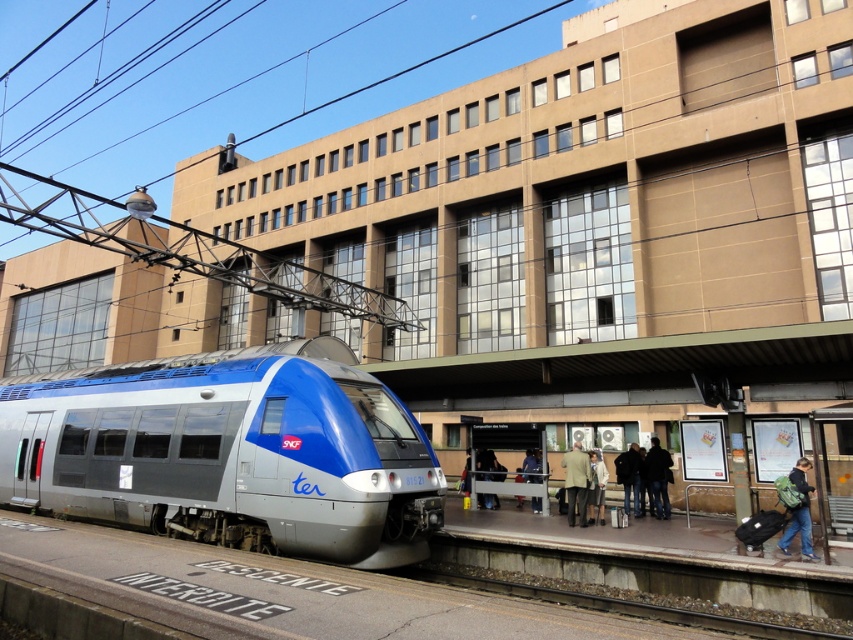
Question: Which object is the farthest from the dark blue jacket at platform right?

Choices:
 (A) metallic silver coach at center
 (B) light beige fabric coat at center
 (C) matte silver bullet train at left

Answer: (C)

Question: Among these objects, which one is farthest from the camera?

Choices:
 (A) metallic silver coach at center
 (B) matte silver bullet train at left
 (C) green backpack at lower right

Answer: (A)

Question: Which object is positioned farthest from the light beige fabric coat at center?

Choices:
 (A) dark blue jacket at platform right
 (B) metallic silver coach at center

Answer: (A)

Question: Can you confirm if matte silver bullet train at left is thinner than metallic silver coach at center?

Choices:
 (A) yes
 (B) no

Answer: (B)

Question: Is green backpack at lower right above light beige fabric coat at center?

Choices:
 (A) yes
 (B) no

Answer: (A)

Question: Can you confirm if green backpack at lower right is bigger than metallic silver coach at center?

Choices:
 (A) no
 (B) yes

Answer: (A)